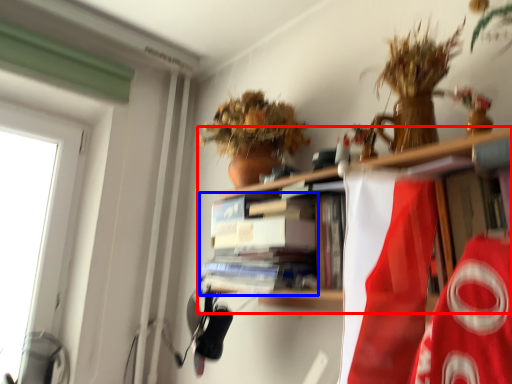
Question: Among these objects, which one is nearest to the camera, shelf (highlighted by a red box) or book (highlighted by a blue box)?

Choices:
 (A) shelf
 (B) book

Answer: (A)